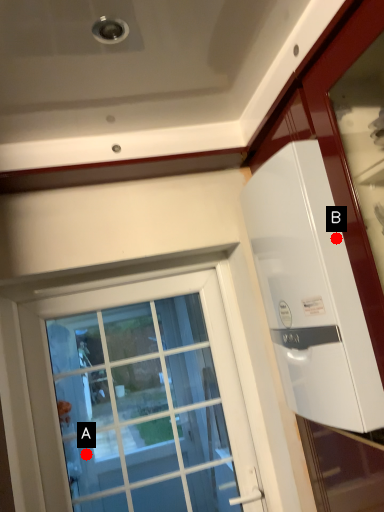
Question: Two points are circled on the image, labeled by A and B beside each circle. Which of the following is the closest to the observer?

Choices:
 (A) A is closer
 (B) B is closer

Answer: (B)